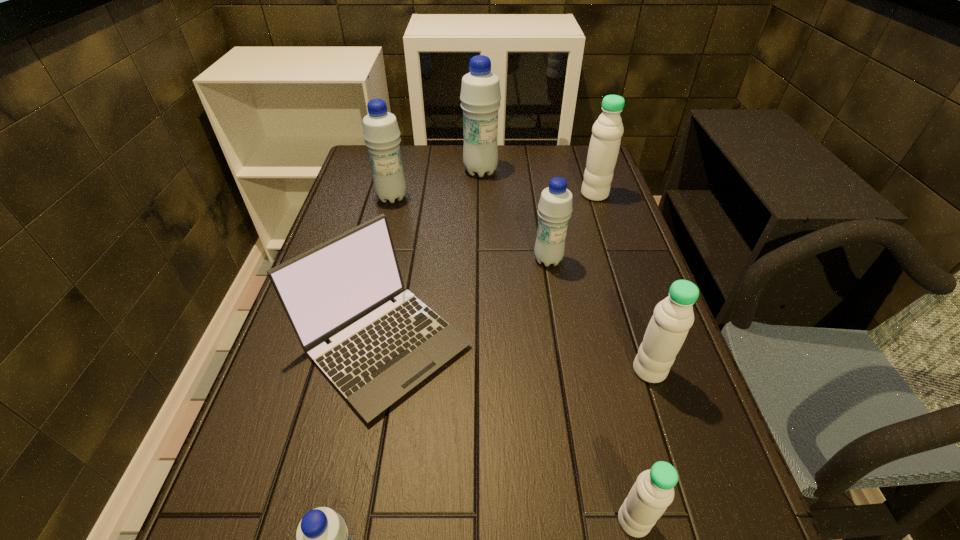
You are a GUI agent. You are given a task and a screenshot of the screen. Output one action in this format:
    pyautogui.click(x=<x>, y=<y>)
    Task: Click on the laptop_computer present at the left edge
    This screenshot has height=540, width=960.
    Given the screenshot: What is the action you would take?
    pyautogui.click(x=341, y=290)

The width and height of the screenshot is (960, 540). Identify the location of free space at the far edge of the desktop. (463, 165).

In the image, there is a desktop. Find the location of `vacant space at the left edge`. vacant space at the left edge is located at coordinates (298, 424).

Find the location of a particular element. This screenshot has height=540, width=960. vacant space at the right edge is located at coordinates (614, 225).

Identify the location of vacant area between the tallest object and the biggest white water bottle. (538, 183).

Where is `free point between the farthest white water bottle and the seventh farthest object`? The height and width of the screenshot is (540, 960). free point between the farthest white water bottle and the seventh farthest object is located at coordinates point(614,357).

At what (x,y) coordinates should I click in order to perform the action: click on empty space that is in between the tallest object and the third water bottle from right to left. Please return your answer as a coordinate pair (x, y). Looking at the image, I should click on (557, 346).

At what (x,y) coordinates should I click in order to perform the action: click on vacant area between the second blue water bottle from right to left and the second smallest white water bottle. Please return your answer as a coordinate pair (x, y). This screenshot has height=540, width=960. Looking at the image, I should click on (565, 271).

You are a GUI agent. You are given a task and a screenshot of the screen. Output one action in this format:
    pyautogui.click(x=<x>, y=<y>)
    Task: Click on the empty space that is in between the fourth farthest object and the biggest white water bottle
    This screenshot has width=960, height=540.
    Given the screenshot: What is the action you would take?
    pyautogui.click(x=571, y=227)

Find the location of a particular element. free space between the farthest white water bottle and the laptop_computer is located at coordinates (490, 269).